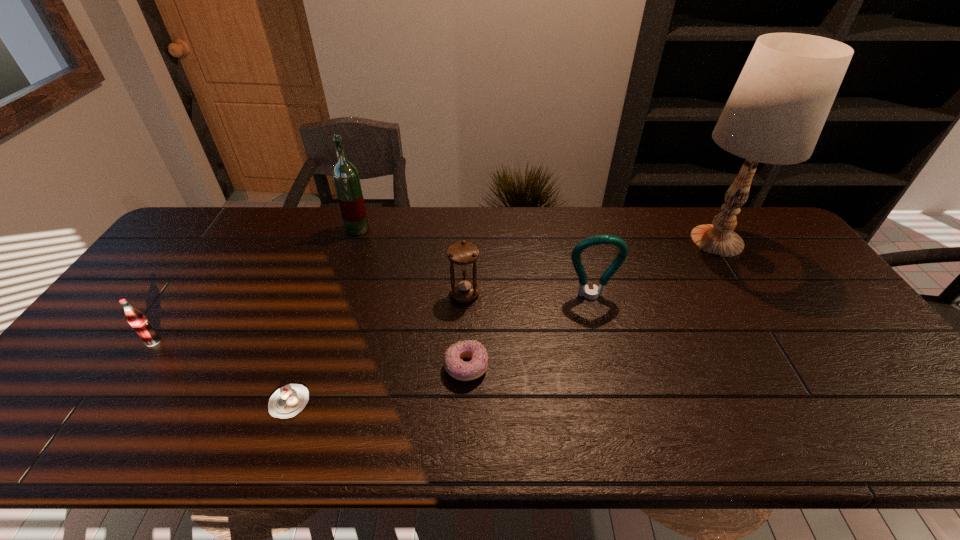
Locate an element on the screen. Image resolution: width=960 pixels, height=540 pixels. vacant position in the image that satisfies the following two spatial constraints: 1. on the back side of the liquor; 2. on the left side of the shortest object is located at coordinates (351, 229).

Image resolution: width=960 pixels, height=540 pixels. What are the coordinates of `blank area in the image that satisfies the following two spatial constraints: 1. on the label of the fifth farthest object; 2. on the left side of the shortest object` in the screenshot? It's located at pos(112,402).